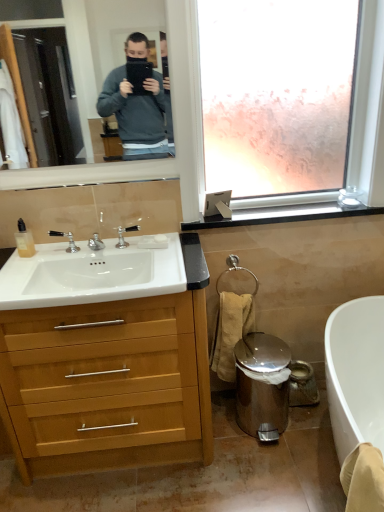
Locate an element on the screen. The height and width of the screenshot is (512, 384). vacant region to the right of polished stainless steel trash can at lower right is located at coordinates (311, 428).